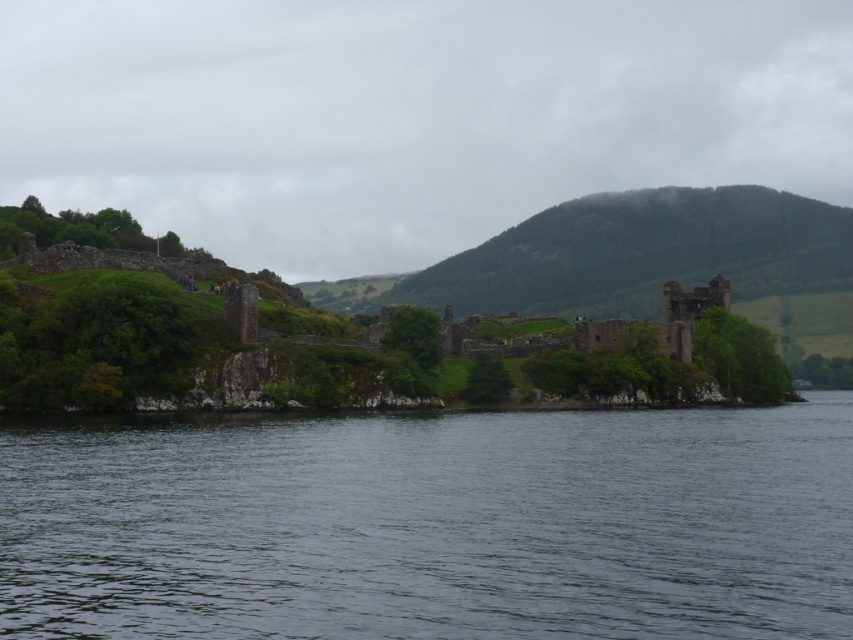
Question: Can you confirm if transparent water at center is positioned to the right of rusty stone castle at center?

Choices:
 (A) yes
 (B) no

Answer: (B)

Question: Which point is farther from the camera taking this photo?

Choices:
 (A) (402, 296)
 (B) (469, 324)

Answer: (A)

Question: Does transparent water at center have a smaller size compared to green grassy hill at center?

Choices:
 (A) no
 (B) yes

Answer: (B)

Question: Does transparent water at center have a smaller size compared to rusty stone castle at center?

Choices:
 (A) yes
 (B) no

Answer: (A)

Question: Which of the following is the closest to the observer?

Choices:
 (A) (689, 531)
 (B) (802, 216)
 (C) (585, 349)

Answer: (A)

Question: Estimate the real-world distances between objects in this image. Which object is closer to the green grassy hill at center?

Choices:
 (A) rusty stone castle at center
 (B) transparent water at center

Answer: (A)